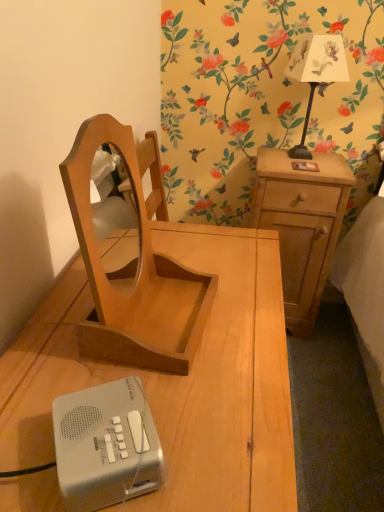
Question: Is light brown wood at right, the second nightstand positioned from the front, shorter than wooden nightstand at center, placed as the second nightstand when sorted from right to left?

Choices:
 (A) no
 (B) yes

Answer: (B)

Question: Can you confirm if light brown wood at right, the first nightstand viewed from the back, is thinner than wooden nightstand at center, the first nightstand viewed from the left?

Choices:
 (A) no
 (B) yes

Answer: (B)

Question: Does light brown wood at right, the 1th nightstand in the right-to-left sequence, have a larger size compared to wooden nightstand at center, which is the first nightstand from front to back?

Choices:
 (A) yes
 (B) no

Answer: (B)

Question: Is light brown wood at right, the first nightstand viewed from the back, placed right next to wooden nightstand at center, which is the first nightstand from front to back?

Choices:
 (A) yes
 (B) no

Answer: (B)

Question: Does light brown wood at right, the first nightstand viewed from the back, come in front of wooden nightstand at center, which is the first nightstand from front to back?

Choices:
 (A) no
 (B) yes

Answer: (A)

Question: Can you confirm if white paper lampshade at upper right is taller than wooden nightstand at center, placed as the second nightstand when sorted from right to left?

Choices:
 (A) no
 (B) yes

Answer: (A)

Question: Is white paper lampshade at upper right touching wooden nightstand at center, which is the first nightstand from front to back?

Choices:
 (A) yes
 (B) no

Answer: (B)

Question: Is white paper lampshade at upper right not within wooden nightstand at center, the first nightstand viewed from the left?

Choices:
 (A) no
 (B) yes

Answer: (B)

Question: Could you tell me if white paper lampshade at upper right is facing wooden nightstand at center, the first nightstand viewed from the left?

Choices:
 (A) yes
 (B) no

Answer: (B)

Question: From the image's perspective, is white paper lampshade at upper right on wooden nightstand at center, placed as the second nightstand when sorted from right to left?

Choices:
 (A) no
 (B) yes

Answer: (B)

Question: From a real-world perspective, is white paper lampshade at upper right on top of wooden nightstand at center, placed as the second nightstand when sorted from right to left?

Choices:
 (A) no
 (B) yes

Answer: (B)

Question: Is light brown wood mirror at center at the left side of white paper lampshade at upper right?

Choices:
 (A) no
 (B) yes

Answer: (B)